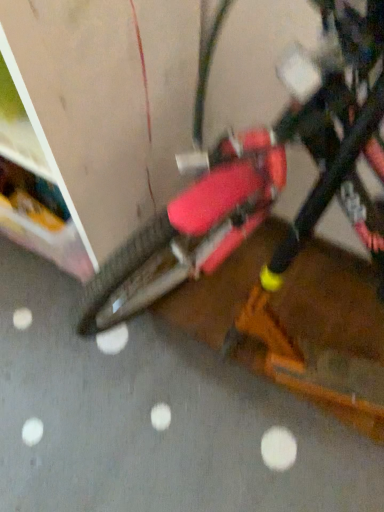
The height and width of the screenshot is (512, 384). What do you see at coordinates (150, 419) in the screenshot?
I see `matte orange scooter at center` at bounding box center [150, 419].

Locate an element on the screen. This screenshot has width=384, height=512. matte orange scooter at center is located at coordinates (150, 419).

In order to face matte red bicycle at center, should I rotate leftwards or rightwards?

Rotate right and turn 17.948 degrees.

Describe the element at coordinates (257, 176) in the screenshot. I see `matte red bicycle at center` at that location.

Find the location of a particular element. This screenshot has width=384, height=512. matte red bicycle at center is located at coordinates click(x=257, y=176).

Where is `matte orange scooter at center`? The height and width of the screenshot is (512, 384). matte orange scooter at center is located at coordinates (150, 419).

Is matte orange scooter at center to the left of matte red bicycle at center from the viewer's perspective?

Correct, you'll find matte orange scooter at center to the left of matte red bicycle at center.

Is the depth of matte orange scooter at center greater than that of matte red bicycle at center?

Yes, the depth of matte orange scooter at center is greater than that of matte red bicycle at center.

Is point (88, 395) closer to viewer compared to point (377, 19)?

No, it is behind (377, 19).

Based on the photo, from the image's perspective, would you say matte orange scooter at center is positioned over matte red bicycle at center?

Incorrect, from the image's perspective, matte orange scooter at center is lower than matte red bicycle at center.

From a real-world perspective, which is physically below, matte orange scooter at center or matte red bicycle at center?

From a 3D spatial view, matte orange scooter at center is below.

In terms of width, does matte orange scooter at center look wider or thinner when compared to matte red bicycle at center?

Clearly, matte orange scooter at center has more width compared to matte red bicycle at center.

In terms of height, does matte orange scooter at center look taller or shorter compared to matte red bicycle at center?

Considering their sizes, matte orange scooter at center has less height than matte red bicycle at center.

Can you confirm if matte orange scooter at center is bigger than matte red bicycle at center?

Actually, matte orange scooter at center might be smaller than matte red bicycle at center.

Is matte orange scooter at center completely or partially outside of matte red bicycle at center?

Yes, matte orange scooter at center is outside of matte red bicycle at center.

Would you consider matte orange scooter at center to be distant from matte red bicycle at center?

No, matte orange scooter at center is not far from matte red bicycle at center.

In the scene shown: Could you tell me if matte orange scooter at center is facing matte red bicycle at center?

No, matte orange scooter at center is not aimed at matte red bicycle at center.

Where is `concrete that appears below the matte red bicycle at center (from the image's perspective)`? The image size is (384, 512). concrete that appears below the matte red bicycle at center (from the image's perspective) is located at coordinates (150, 419).

In the image, is matte red bicycle at center on the left side or the right side of matte orange scooter at center?

Clearly, matte red bicycle at center is on the right of matte orange scooter at center in the image.

Is the depth of matte red bicycle at center greater than that of matte orange scooter at center?

No, the depth of matte red bicycle at center is less than that of matte orange scooter at center.

Which is closer, (302, 136) or (59, 481)?

Point (302, 136) is positioned closer to the camera compared to point (59, 481).

From the image's perspective, is matte red bicycle at center located above or below matte orange scooter at center?

Based on their image positions, matte red bicycle at center is located above matte orange scooter at center.

Consider the image. From a real-world perspective, relative to matte orange scooter at center, is matte red bicycle at center vertically above or below?

Clearly, from a real-world perspective, matte red bicycle at center is above matte orange scooter at center.

Can you confirm if matte red bicycle at center is wider than matte orange scooter at center?

No, matte red bicycle at center is not wider than matte orange scooter at center.

Which of these two, matte red bicycle at center or matte orange scooter at center, stands taller?

With more height is matte red bicycle at center.

Considering the relative sizes of matte red bicycle at center and matte orange scooter at center in the image provided, is matte red bicycle at center smaller than matte orange scooter at center?

Actually, matte red bicycle at center might be larger than matte orange scooter at center.

Is matte red bicycle at center outside of matte orange scooter at center?

matte red bicycle at center lies outside matte orange scooter at center's area.

Are matte red bicycle at center and matte orange scooter at center beside each other?

No, matte red bicycle at center is not in contact with matte orange scooter at center.

Is matte red bicycle at center facing away from matte orange scooter at center?

No, matte red bicycle at center is not facing away from matte orange scooter at center.

The width and height of the screenshot is (384, 512). Identify the location of bicycle on the right of matte orange scooter at center. (257, 176).

You are a GUI agent. You are given a task and a screenshot of the screen. Output one action in this format:
    pyautogui.click(x=<x>, y=<y>)
    Task: Click on the bicycle above the matte orange scooter at center (from the image's perspective)
    Image resolution: width=384 pixels, height=512 pixels.
    Given the screenshot: What is the action you would take?
    pyautogui.click(x=257, y=176)

What are the coordinates of `bicycle that is on the right side of matte orange scooter at center` in the screenshot? It's located at (257, 176).